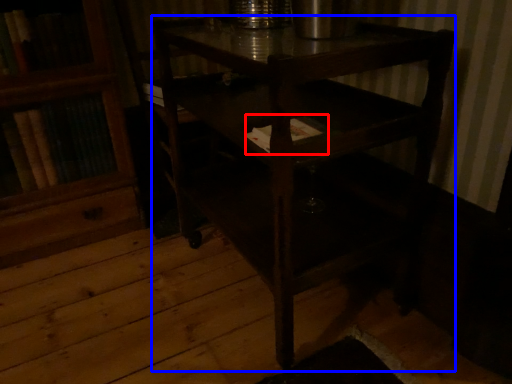
Question: Which of the following is the farthest to the observer, book (highlighted by a red box) or table (highlighted by a blue box)?

Choices:
 (A) book
 (B) table

Answer: (A)